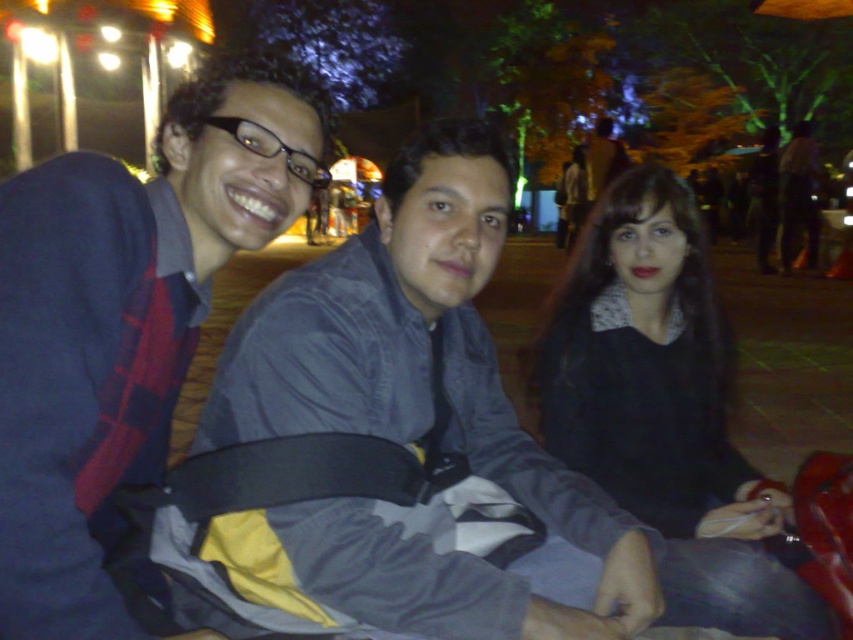
Question: Is the position of plaid fabric shirt at left less distant than that of black matte sweater at center?

Choices:
 (A) yes
 (B) no

Answer: (A)

Question: Which point is closer to the camera?

Choices:
 (A) (555, 436)
 (B) (112, 604)

Answer: (B)

Question: Does plaid fabric shirt at left appear over black matte sweater at center?

Choices:
 (A) yes
 (B) no

Answer: (A)

Question: Which point is closer to the camera?

Choices:
 (A) (10, 362)
 (B) (786, 620)

Answer: (A)

Question: From the image, what is the correct spatial relationship of plaid fabric shirt at left in relation to black matte sweater at center?

Choices:
 (A) right
 (B) left

Answer: (B)